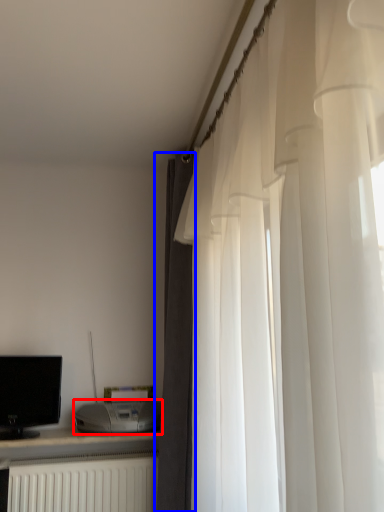
Question: Which object is further to the camera taking this photo, appliance (highlighted by a red box) or curtain (highlighted by a blue box)?

Choices:
 (A) appliance
 (B) curtain

Answer: (A)